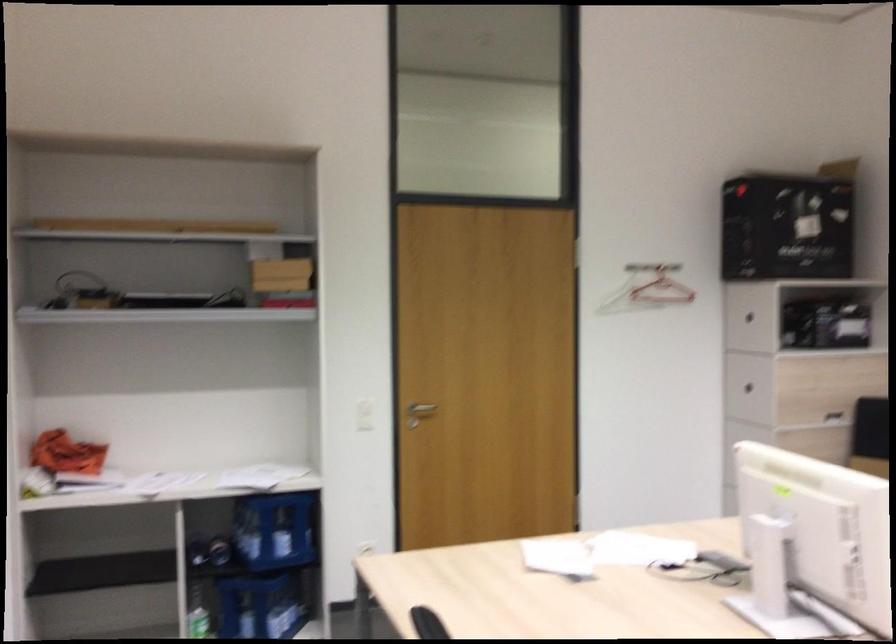
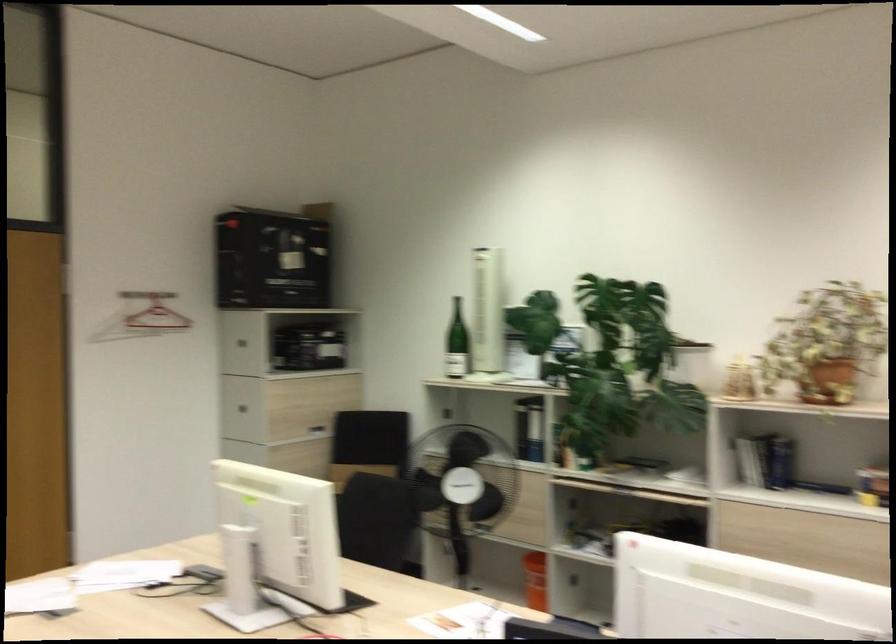
Where in the second image is the point corresponding to pixel 652 292 from the first image?

(142, 317)